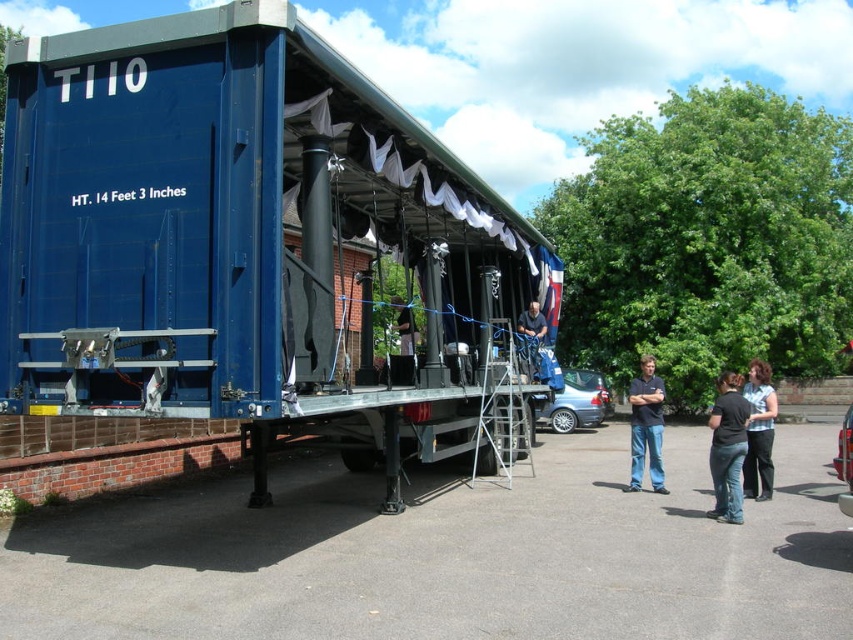
Which is below, blue matte trailer truck at center or dark blue fabric at center?

dark blue fabric at center

In the scene shown: Between blue matte trailer truck at center and dark blue fabric at center, which one has less height?

dark blue fabric at center

Does point (56, 106) come farther from viewer compared to point (537, 339)?

No, (56, 106) is in front of (537, 339).

This screenshot has height=640, width=853. Identify the location of blue matte trailer truck at center. (250, 244).

Who is lower down, blue denim jeans at lower right or black fabric at center?

Positioned lower is blue denim jeans at lower right.

Which is above, blue denim jeans at lower right or black fabric at center?

Positioned higher is black fabric at center.

Which is in front, point (764, 372) or point (405, 380)?

Point (764, 372) is in front.

What are the coordinates of `blue denim jeans at lower right` in the screenshot? It's located at (759, 432).

Which of these two, dark blue jeans at center or dark blue fabric at center, stands taller?

Standing taller between the two is dark blue jeans at center.

Looking at this image, who is lower down, dark blue jeans at center or dark blue fabric at center?

dark blue jeans at center

Measure the distance between point (643, 404) and camera.

9.55 meters

Find the location of a particular element. Image resolution: width=853 pixels, height=640 pixels. dark blue jeans at center is located at coordinates (646, 426).